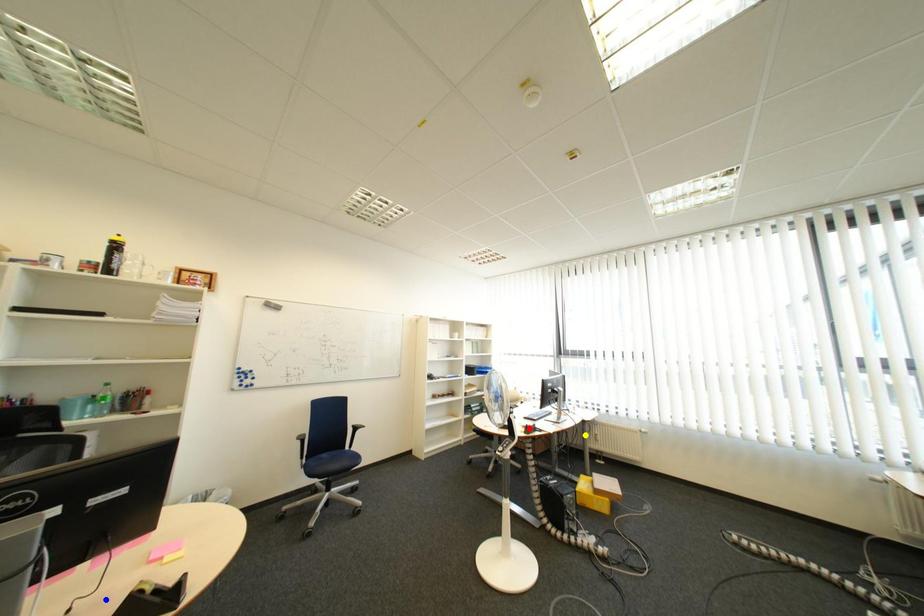
Order these from nearest to farthest:
yellow point | red point | blue point

blue point → red point → yellow point